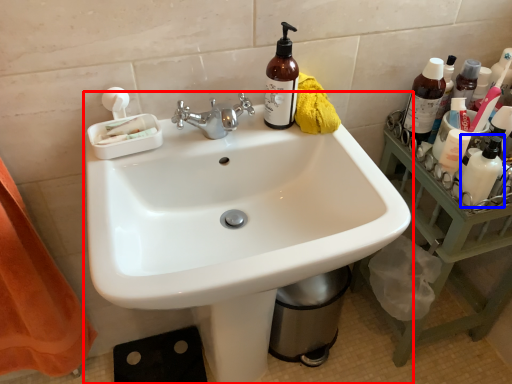
Question: Which point is closer to the camera, sink (highlighted by a red box) or toiletry (highlighted by a blue box)?

Choices:
 (A) sink
 (B) toiletry

Answer: (A)